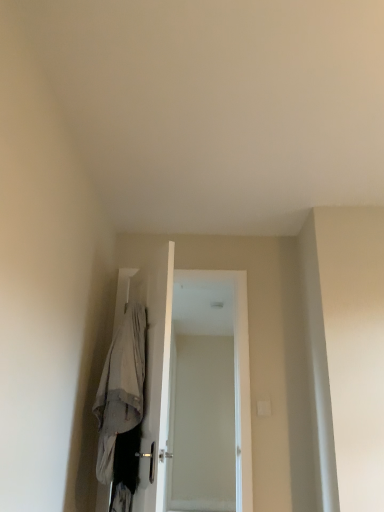
In order to face white glossy screen door at center, should I rotate leftwards or rightwards?

Rotate your view left by about 1.089°.

Measure the distance between point (242,490) and camera.

Point (242,490) is 8.45 feet from camera.

What do you see at coordinates (236, 376) in the screenshot?
I see `white glossy screen door at center` at bounding box center [236, 376].

Find the location of a particular element. Image resolution: width=384 pixels, height=512 pixels. white glossy screen door at center is located at coordinates (236, 376).

From the picture: In order to face light gray fabric robe at center, should I rotate leftwards or rightwards?

Turn left by 9.764 degrees to look at light gray fabric robe at center.

In order to click on light gray fabric robe at center in this screenshot , I will do `click(121, 388)`.

What do you see at coordinates (121, 388) in the screenshot? I see `light gray fabric robe at center` at bounding box center [121, 388].

Measure the distance between point [109,462] and camera.

They are 2.19 meters apart.

Identify the location of white glossy screen door at center. This screenshot has width=384, height=512. (236, 376).

Visually, is white glossy screen door at center positioned to the left or to the right of light gray fabric robe at center?

Based on their positions, white glossy screen door at center is located to the right of light gray fabric robe at center.

Does white glossy screen door at center lie in front of light gray fabric robe at center?

No, it is behind light gray fabric robe at center.

Is point (245, 461) closer or farther from the camera than point (106, 438)?

Point (245, 461) is positioned farther from the camera compared to point (106, 438).

From the image's perspective, which object appears higher, white glossy screen door at center or light gray fabric robe at center?

light gray fabric robe at center, from the image's perspective.

From a real-world perspective, between white glossy screen door at center and light gray fabric robe at center, who is vertically lower?

light gray fabric robe at center, from a real-world perspective.

Which of these two, white glossy screen door at center or light gray fabric robe at center, is thinner?

Thinner between the two is white glossy screen door at center.

Can you confirm if white glossy screen door at center is shorter than light gray fabric robe at center?

No, white glossy screen door at center is not shorter than light gray fabric robe at center.

Can you confirm if white glossy screen door at center is smaller than light gray fabric robe at center?

No, white glossy screen door at center is not smaller than light gray fabric robe at center.

Is white glossy screen door at center inside the boundaries of light gray fabric robe at center, or outside?

white glossy screen door at center exists outside the volume of light gray fabric robe at center.

Would you consider white glossy screen door at center to be distant from light gray fabric robe at center?

white glossy screen door at center is near light gray fabric robe at center, not far away.

Is white glossy screen door at center oriented away from light gray fabric robe at center?

That's not correct — white glossy screen door at center is not looking away from light gray fabric robe at center.

How different are the orientations of white glossy screen door at center and light gray fabric robe at center in degrees?

66.9 degrees separate the facing orientations of white glossy screen door at center and light gray fabric robe at center.

At what (x,y) coordinates should I click in order to perform the action: click on screen door that is behind the light gray fabric robe at center. Please return your answer as a coordinate pair (x, y). Looking at the image, I should click on (236, 376).

Is light gray fabric robe at center at the left side of white glossy screen door at center?

Yes, light gray fabric robe at center is to the left of white glossy screen door at center.

Based on the photo, considering the relative positions of light gray fabric robe at center and white glossy screen door at center in the image provided, is light gray fabric robe at center in front of white glossy screen door at center?

That is True.

Considering the points (111, 421) and (239, 414), which point is behind, point (111, 421) or point (239, 414)?

Point (239, 414)

From the image's perspective, is light gray fabric robe at center positioned above or below white glossy screen door at center?

Based on their image positions, light gray fabric robe at center is located above white glossy screen door at center.

From a real-world perspective, is light gray fabric robe at center under white glossy screen door at center?

Yes, from a real-world perspective, light gray fabric robe at center is beneath white glossy screen door at center.

Considering the relative sizes of light gray fabric robe at center and white glossy screen door at center in the image provided, is light gray fabric robe at center wider than white glossy screen door at center?

Yes.

From the picture: Considering the sizes of objects light gray fabric robe at center and white glossy screen door at center in the image provided, who is shorter, light gray fabric robe at center or white glossy screen door at center?

Standing shorter between the two is light gray fabric robe at center.

In the scene shown: Between light gray fabric robe at center and white glossy screen door at center, which one has larger size?

With larger size is white glossy screen door at center.

Would you say light gray fabric robe at center contains white glossy screen door at center?

No, white glossy screen door at center is not surrounded by light gray fabric robe at center.

Is light gray fabric robe at center placed right next to white glossy screen door at center?

No.

Could you tell me if light gray fabric robe at center is facing white glossy screen door at center?

No, light gray fabric robe at center is not aimed at white glossy screen door at center.

Measure the distance from light gray fabric robe at center to white glossy screen door at center.

light gray fabric robe at center and white glossy screen door at center are 31.35 inches apart.

Where is `robe in front of the white glossy screen door at center`? The height and width of the screenshot is (512, 384). robe in front of the white glossy screen door at center is located at coordinates (121, 388).

Where is `screen door located above the light gray fabric robe at center (from a real-world perspective)`? The image size is (384, 512). screen door located above the light gray fabric robe at center (from a real-world perspective) is located at coordinates (236, 376).

At what (x,y) coordinates should I click in order to perform the action: click on screen door that appears below the light gray fabric robe at center (from the image's perspective). Please return your answer as a coordinate pair (x, y). The width and height of the screenshot is (384, 512). Looking at the image, I should click on (236, 376).